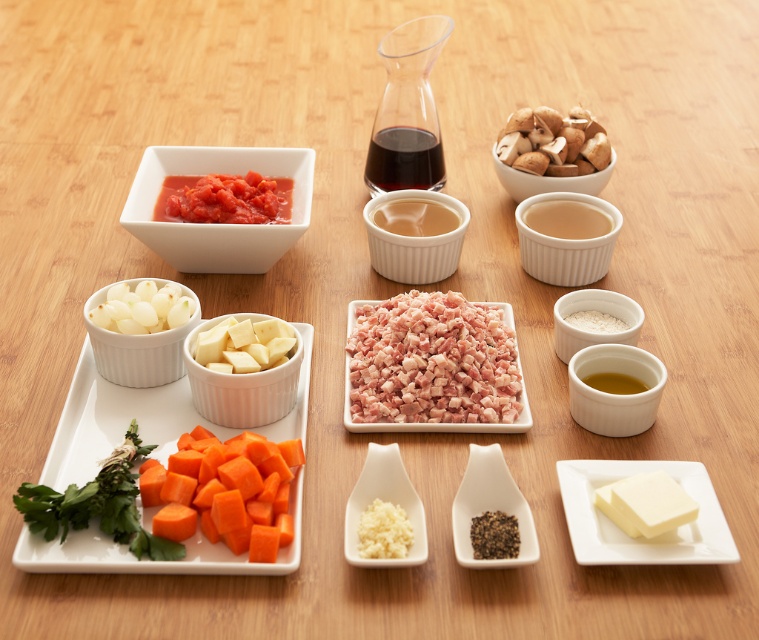
Question: Is green leafy herb at lower left closer to the viewer compared to brown crumbly mushrooms at upper right?

Choices:
 (A) no
 (B) yes

Answer: (B)

Question: Considering the real-world distances, which object is farthest from the brown matte mushrooms at upper right?

Choices:
 (A) yellow creamy sauce at center right
 (B) pinkish-red meat at center
 (C) white granular garlic at center
 (D) dark glossy liquid at center

Answer: (C)

Question: Is matte white bowl at upper left behind white creamy cheese at lower right?

Choices:
 (A) yes
 (B) no

Answer: (A)

Question: Which object appears farthest from the camera in this image?

Choices:
 (A) matte white sauce at center
 (B) yellow matte oil at lower right
 (C) matte white ramekin at center right

Answer: (A)

Question: Estimate the real-world distances between objects in this image. Which object is farther from the orange diced carrot at lower left?

Choices:
 (A) white smooth butter at lower right
 (B) translucent glass sauce at center
 (C) matte white sauce at center
 (D) green leafy herb at lower left

Answer: (C)

Question: Can you confirm if green leafy herb at lower left is wider than yellow creamy sauce at center right?

Choices:
 (A) yes
 (B) no

Answer: (A)